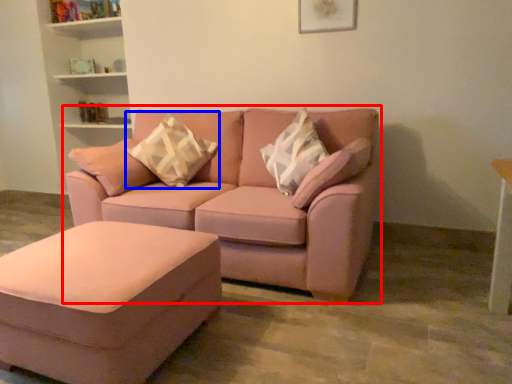
Question: Which of the following is the closest to the observer, studio couch (highlighted by a red box) or pillow (highlighted by a blue box)?

Choices:
 (A) studio couch
 (B) pillow

Answer: (A)